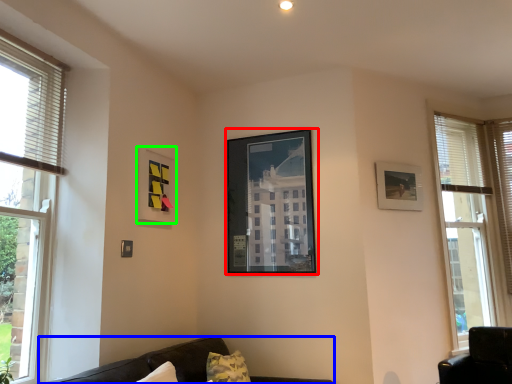
Question: Estimate the real-world distances between objects in this image. Which object is farther from picture frame (highlighted by a red box), studio couch (highlighted by a blue box) or picture frame (highlighted by a green box)?

Choices:
 (A) studio couch
 (B) picture frame

Answer: (A)